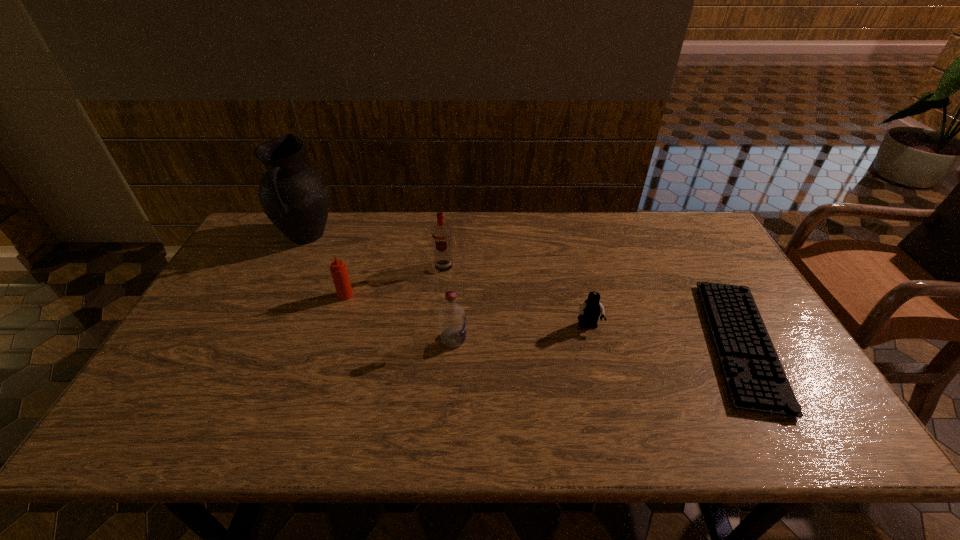
Where is `vacant region between the tallest object and the shortest object`? The width and height of the screenshot is (960, 540). vacant region between the tallest object and the shortest object is located at coordinates (523, 290).

The width and height of the screenshot is (960, 540). Identify the location of blank region between the taller vodka and the Tabasco sauce. (395, 281).

At what (x,y) coordinates should I click in order to perform the action: click on free spot between the leftmost object and the shortest object. Please return your answer as a coordinate pair (x, y). This screenshot has height=540, width=960. Looking at the image, I should click on (523, 290).

At what (x,y) coordinates should I click in order to perform the action: click on vacant point located between the Lego and the computer keyboard. Please return your answer as a coordinate pair (x, y). The height and width of the screenshot is (540, 960). Looking at the image, I should click on (664, 335).

Identify the location of free space between the nearer vodka and the Tabasco sauce. The height and width of the screenshot is (540, 960). (399, 318).

Where is `object that is the closest to the shortest object`? object that is the closest to the shortest object is located at coordinates 590,310.

The height and width of the screenshot is (540, 960). I want to click on the closest object to the taller vodka, so click(x=452, y=321).

Locate an element on the screen. The image size is (960, 540). vacant position in the image that satisfies the following two spatial constraints: 1. on the back side of the shortest object; 2. on the label of the shorter vodka is located at coordinates (737, 339).

Find the location of a particular element. This screenshot has height=540, width=960. vacant space that satisfies the following two spatial constraints: 1. on the side of the farthest object with the handle; 2. on the left side of the Tabasco sauce is located at coordinates (277, 295).

Image resolution: width=960 pixels, height=540 pixels. Find the location of `vacant space that satisfies the following two spatial constraints: 1. on the front-facing side of the computer keyboard; 2. on the right side of the fifth tallest object`. vacant space that satisfies the following two spatial constraints: 1. on the front-facing side of the computer keyboard; 2. on the right side of the fifth tallest object is located at coordinates (592, 343).